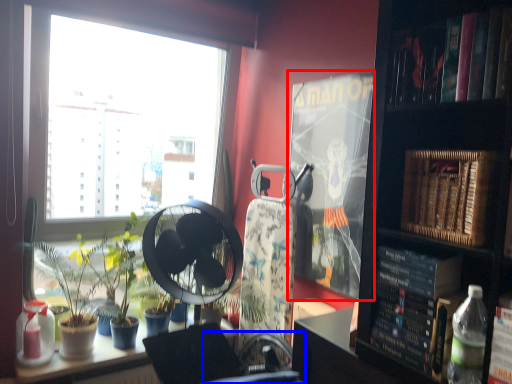
Question: Which of the following is the closest to the observer, paperback book (highlighted by a red box) or swivel chair (highlighted by a blue box)?

Choices:
 (A) paperback book
 (B) swivel chair

Answer: (B)